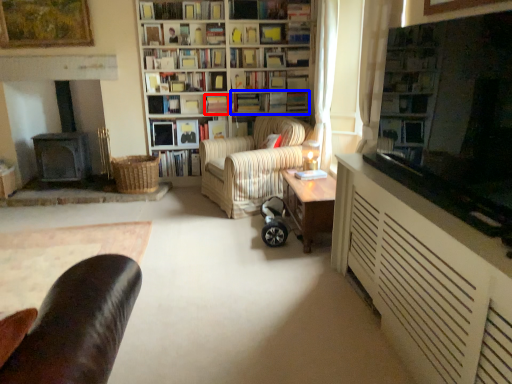
Question: Which object is further to the camera taking this photo, book (highlighted by a red box) or book (highlighted by a blue box)?

Choices:
 (A) book
 (B) book

Answer: (B)